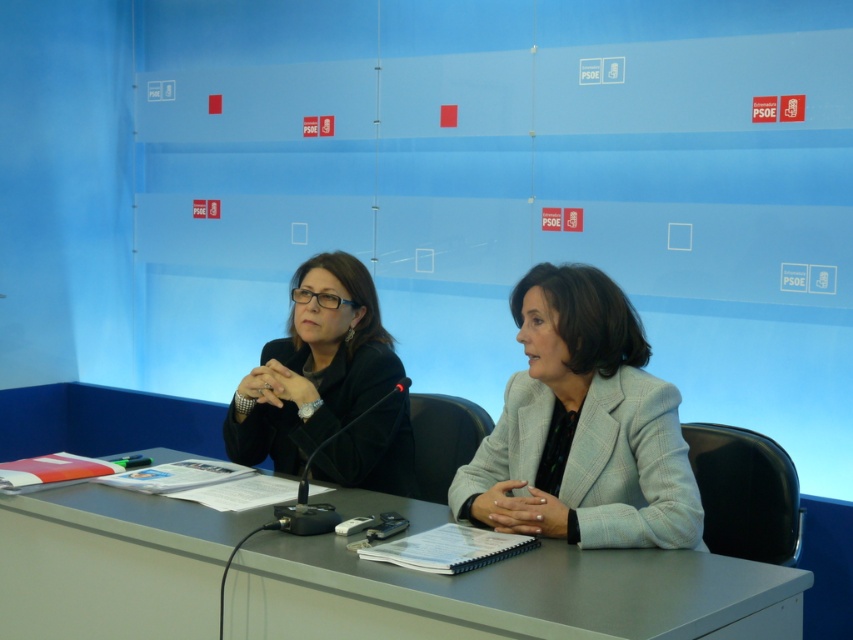
Which is above, light gray textured blazer at center or black matte jacket at center?

black matte jacket at center

This screenshot has height=640, width=853. I want to click on light gray textured blazer at center, so click(582, 428).

Is gray matte table at center positioned behind black matte jacket at center?

No, gray matte table at center is closer to the viewer.

Can you confirm if gray matte table at center is positioned to the right of black matte jacket at center?

Yes, gray matte table at center is to the right of black matte jacket at center.

This screenshot has width=853, height=640. I want to click on gray matte table at center, so pos(508,595).

Does gray matte table at center appear on the right side of light gray textured blazer at center?

Incorrect, gray matte table at center is not on the right side of light gray textured blazer at center.

Is gray matte table at center taller than light gray textured blazer at center?

No.

You are a GUI agent. You are given a task and a screenshot of the screen. Output one action in this format:
    pyautogui.click(x=<x>, y=<y>)
    Task: Click on the gray matte table at center
    Image resolution: width=853 pixels, height=640 pixels.
    Given the screenshot: What is the action you would take?
    pyautogui.click(x=508, y=595)